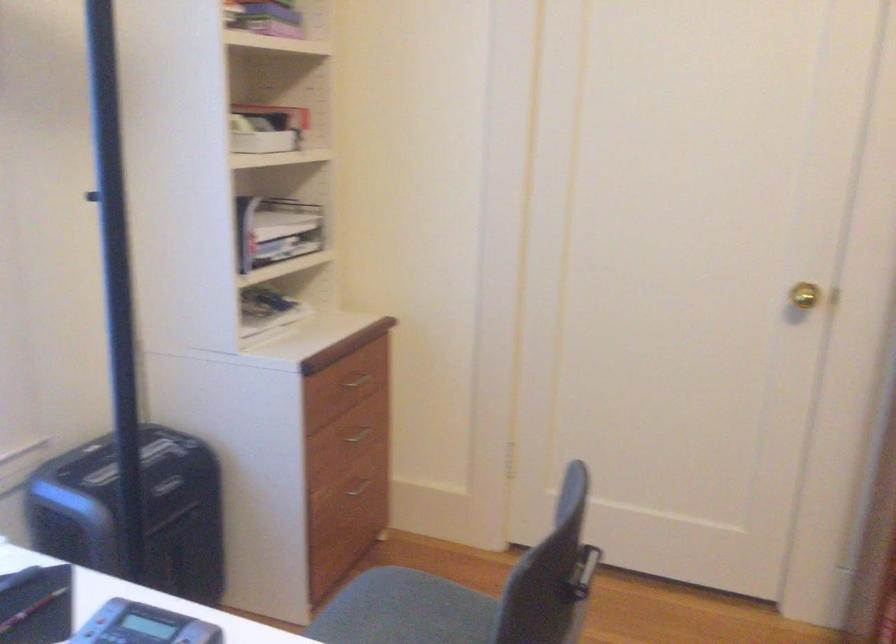
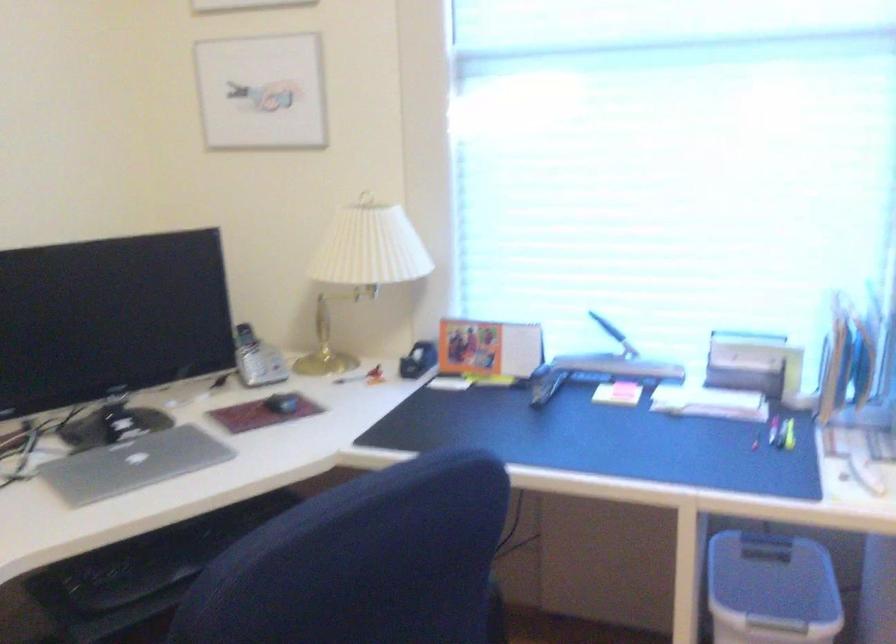
Question: The camera is either moving clockwise (left) or counter-clockwise (right) around the object. The first image is from the beginning of the video and the second image is from the end. Is the camera moving left or right when shooting the video?

Choices:
 (A) Left
 (B) Right

Answer: (B)